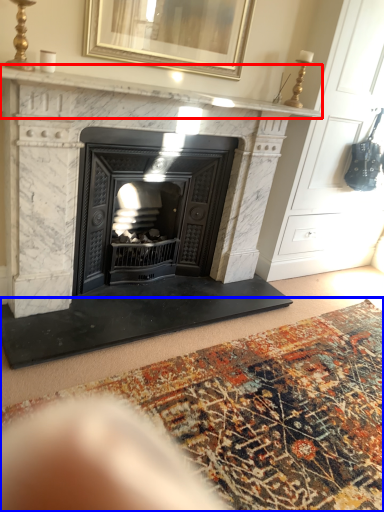
Question: Which of the following is the closest to the observer, mantle (highlighted by a red box) or mat (highlighted by a blue box)?

Choices:
 (A) mantle
 (B) mat

Answer: (B)